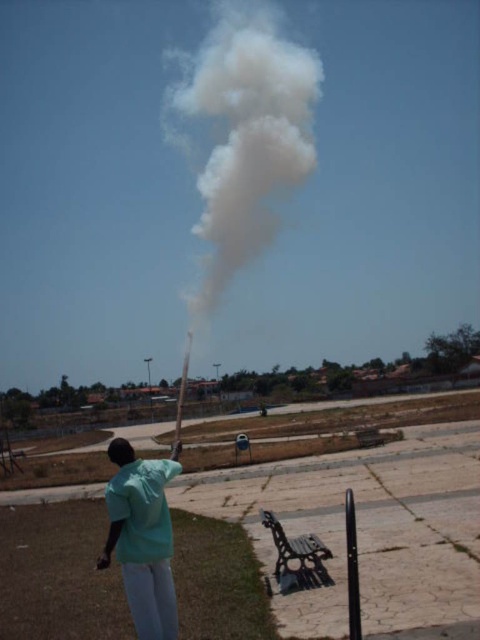
Is point (218, 86) more distant than point (112, 525)?

Yes, it is behind point (112, 525).

Is white fluffy smoke at center further to the viewer compared to green fabric shirt at center?

Yes, white fluffy smoke at center is further from the viewer.

Where is `white fluffy smoke at center`? Image resolution: width=480 pixels, height=640 pixels. white fluffy smoke at center is located at coordinates (245, 136).

At what (x,y) coordinates should I click in order to perform the action: click on white fluffy smoke at center. Please return your answer as a coordinate pair (x, y). This screenshot has width=480, height=640. Looking at the image, I should click on (245, 136).